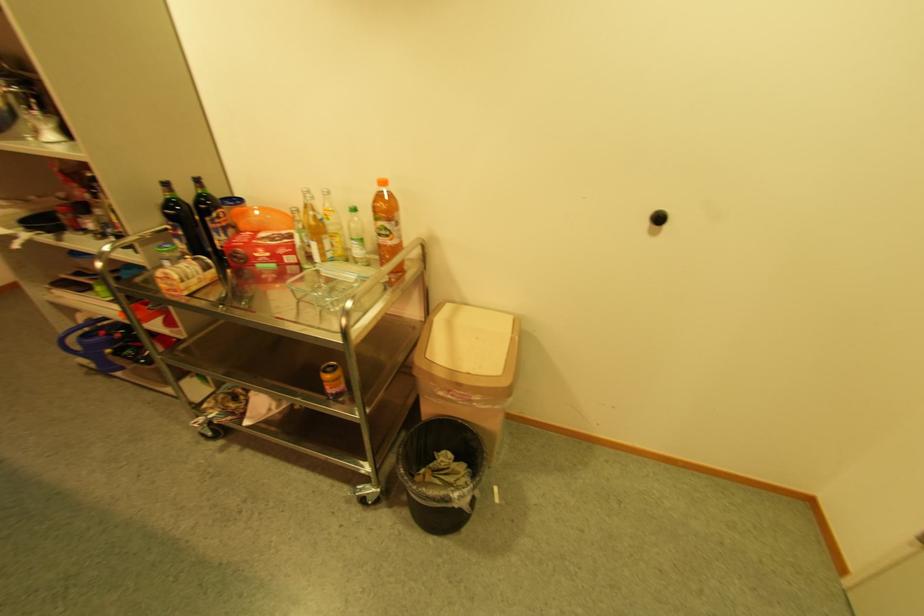
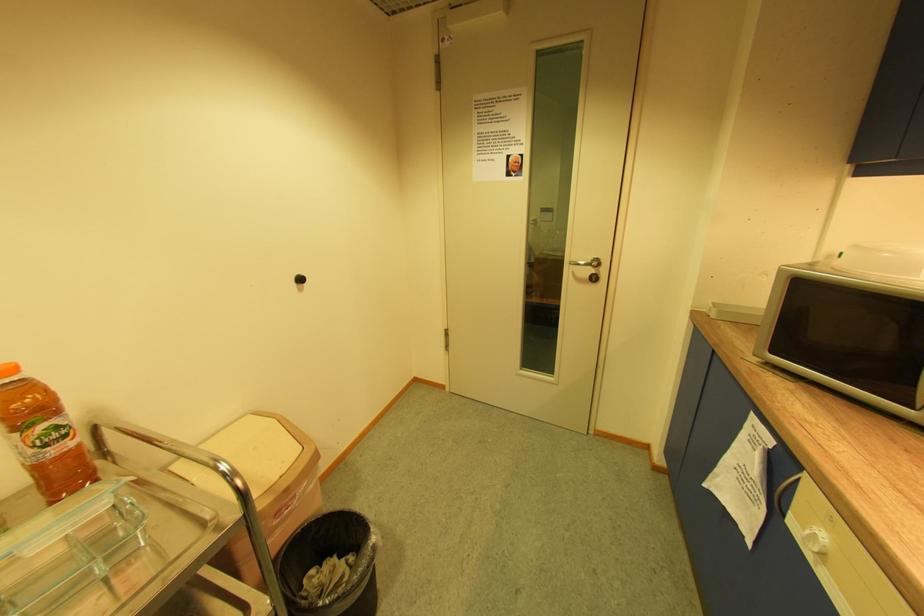
In the second image, find the point that corresponds to [391,233] in the first image.

(61, 437)